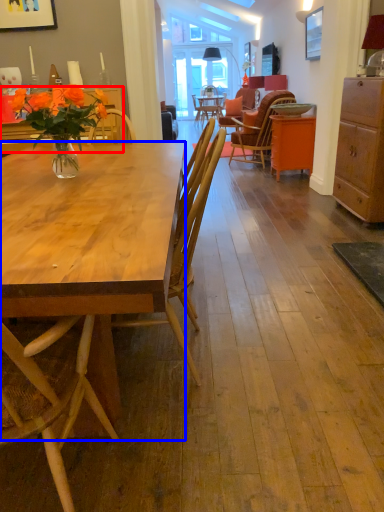
Question: Among these objects, which one is farthest to the camera, desk (highlighted by a red box) or desk (highlighted by a blue box)?

Choices:
 (A) desk
 (B) desk

Answer: (A)